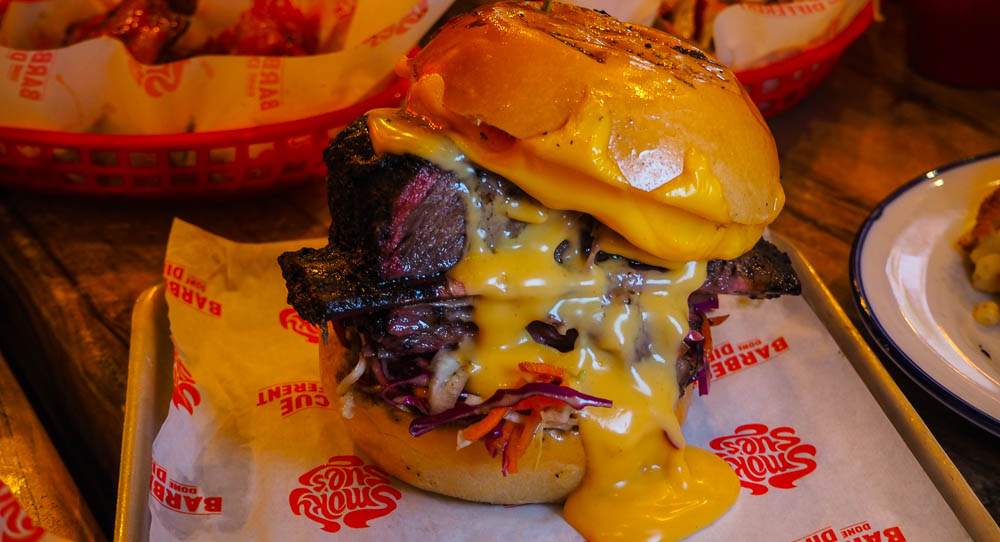
The width and height of the screenshot is (1000, 542). Identify the location of wooden boards. (22, 436), (65, 286), (838, 190), (983, 101).